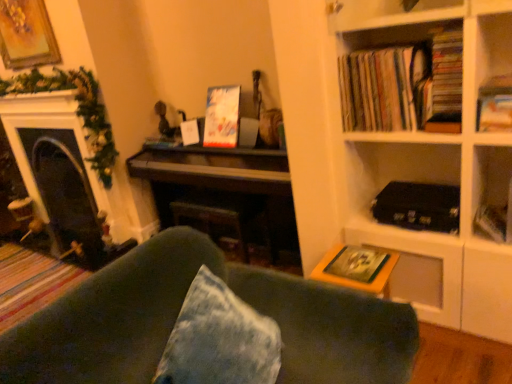
The height and width of the screenshot is (384, 512). I want to click on vacant space underneath yellow matte paperback book at lower right, acting as the second paperback book starting from the right (from a real-world perspective), so click(353, 266).